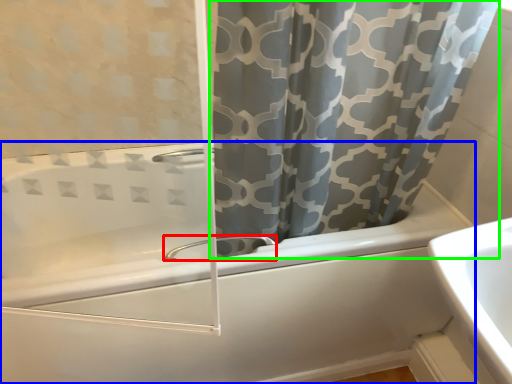
Question: Estimate the real-world distances between objects in this image. Which object is farther from tap (highlighted by a red box), bathtub (highlighted by a blue box) or curtain (highlighted by a green box)?

Choices:
 (A) bathtub
 (B) curtain

Answer: (B)